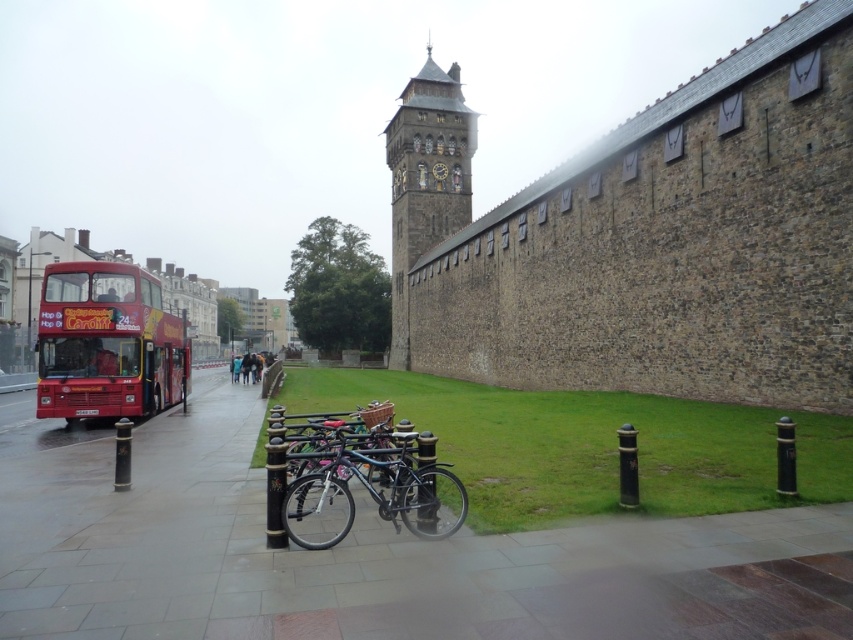
Between stone clock tower at upper center and shiny metallic bicycle at center, which one has less height?

shiny metallic bicycle at center

Is stone clock tower at upper center bigger than shiny metallic bicycle at center?

Yes, stone clock tower at upper center is bigger than shiny metallic bicycle at center.

Between point (426, 100) and point (418, 484), which one is positioned behind?

The point (426, 100) is more distant.

The height and width of the screenshot is (640, 853). Identify the location of stone clock tower at upper center. (425, 180).

Which is behind, point (199, 548) or point (47, 268)?

The point (47, 268) is more distant.

Who is taller, smooth concrete pavement at center or red matte double-decker bus at left?

red matte double-decker bus at left is taller.

The height and width of the screenshot is (640, 853). Find the location of `smooth concrete pavement at center`. smooth concrete pavement at center is located at coordinates (369, 554).

Where is `smooth concrete pavement at center`? The image size is (853, 640). smooth concrete pavement at center is located at coordinates (369, 554).

From the picture: Between smooth concrete pavement at center and stone clock tower at upper center, which one appears on the left side from the viewer's perspective?

smooth concrete pavement at center is more to the left.

Does smooth concrete pavement at center appear under stone clock tower at upper center?

Correct, smooth concrete pavement at center is located below stone clock tower at upper center.

The height and width of the screenshot is (640, 853). Describe the element at coordinates (369, 554) in the screenshot. I see `smooth concrete pavement at center` at that location.

Identify the location of smooth concrete pavement at center. This screenshot has width=853, height=640. (369, 554).